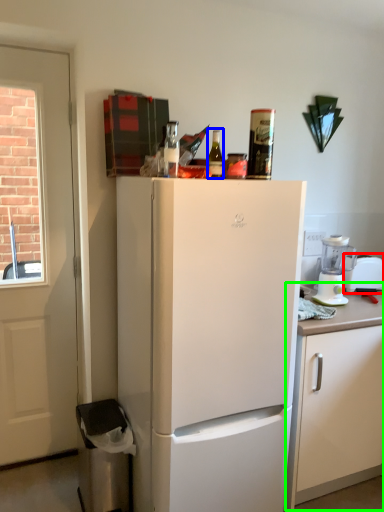
Question: Estimate the real-world distances between objects in this image. Which object is closer to appliance (highlighted by a red box), bottle (highlighted by a blue box) or cabinetry (highlighted by a green box)?

Choices:
 (A) bottle
 (B) cabinetry

Answer: (B)